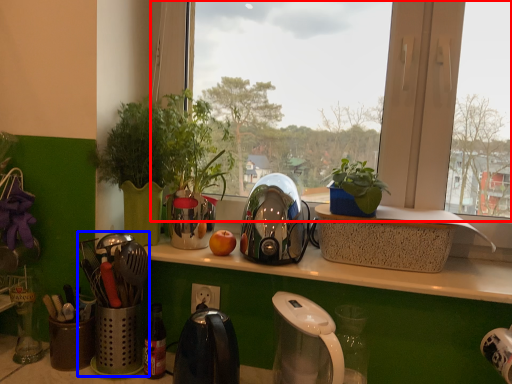
Question: Among these objects, which one is farthest to the camera, window (highlighted by a red box) or appliance (highlighted by a blue box)?

Choices:
 (A) window
 (B) appliance

Answer: (A)